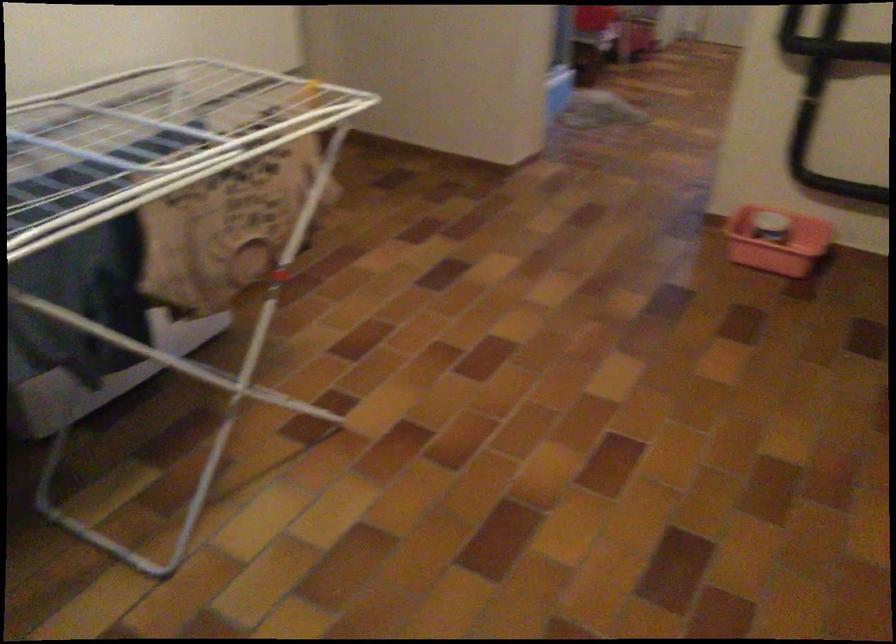
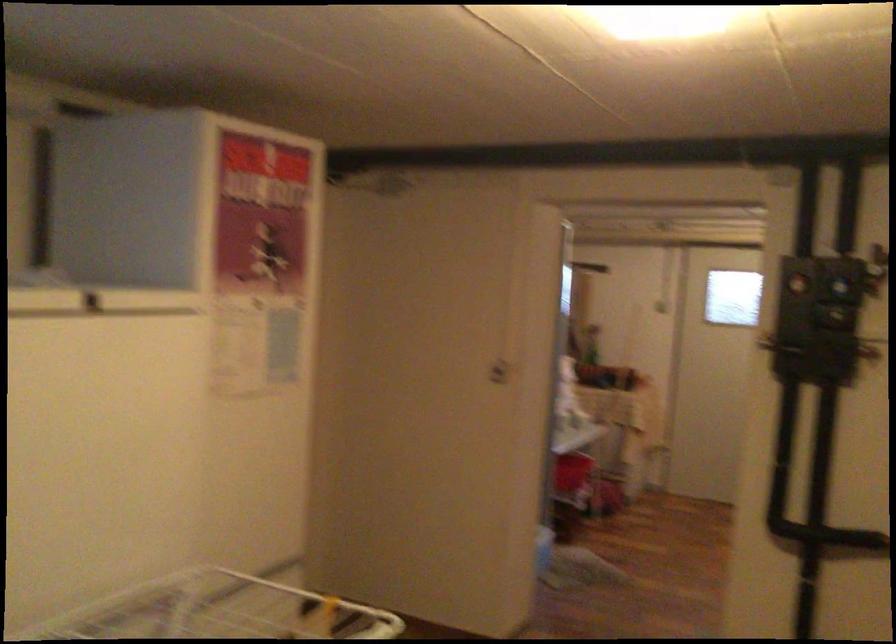
Question: The first image is from the beginning of the video and the second image is from the end. How did the camera likely rotate when shooting the video?

Choices:
 (A) Left
 (B) Right
 (C) Up
 (D) Down

Answer: (C)